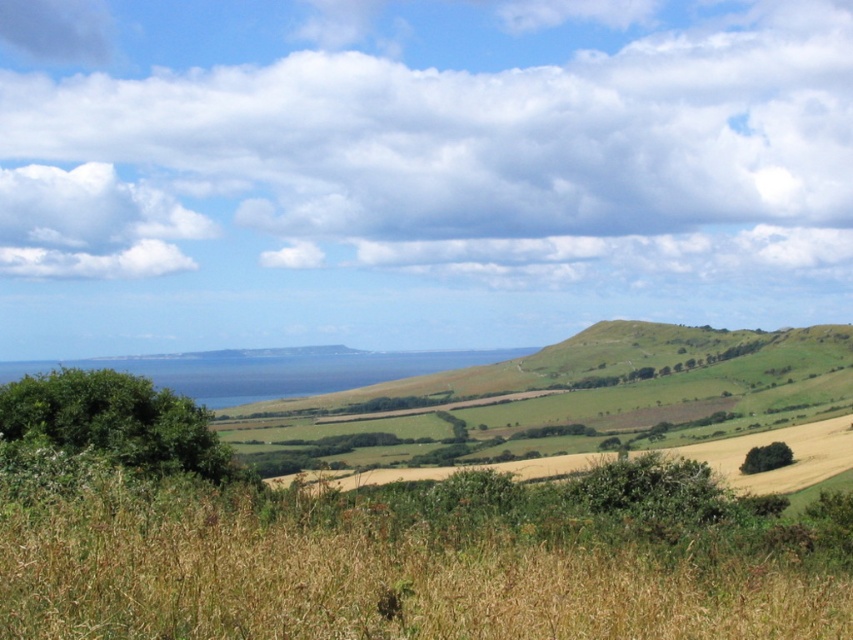
You are looking at the sky in the rural landscape and see two white fluffy clouds. One is labeled as the white fluffy cloud at upper center and the other as the white fluffy cloud at upper left. From your perspective, which cloud is positioned to the right?

The white fluffy cloud at upper center is positioned to the right of the white fluffy cloud at upper left.